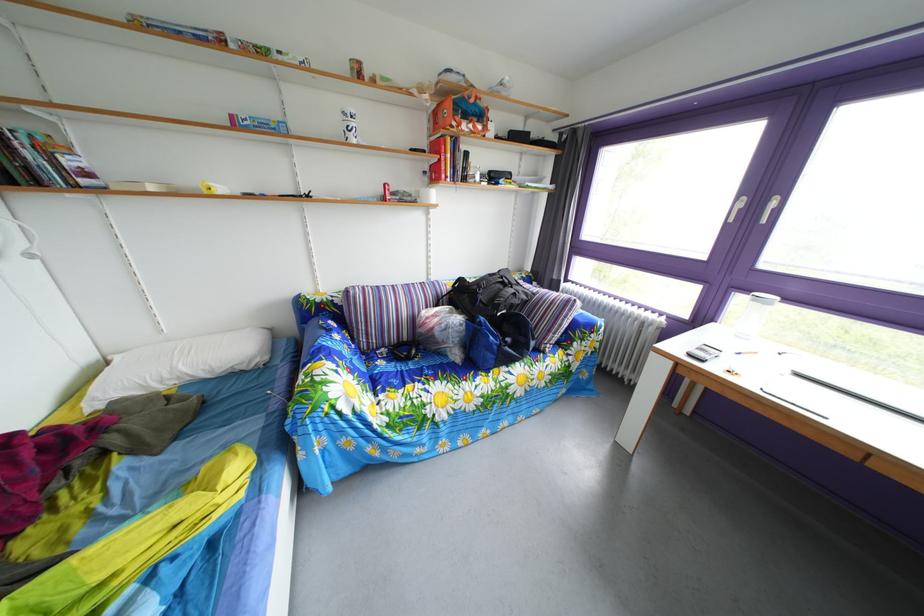
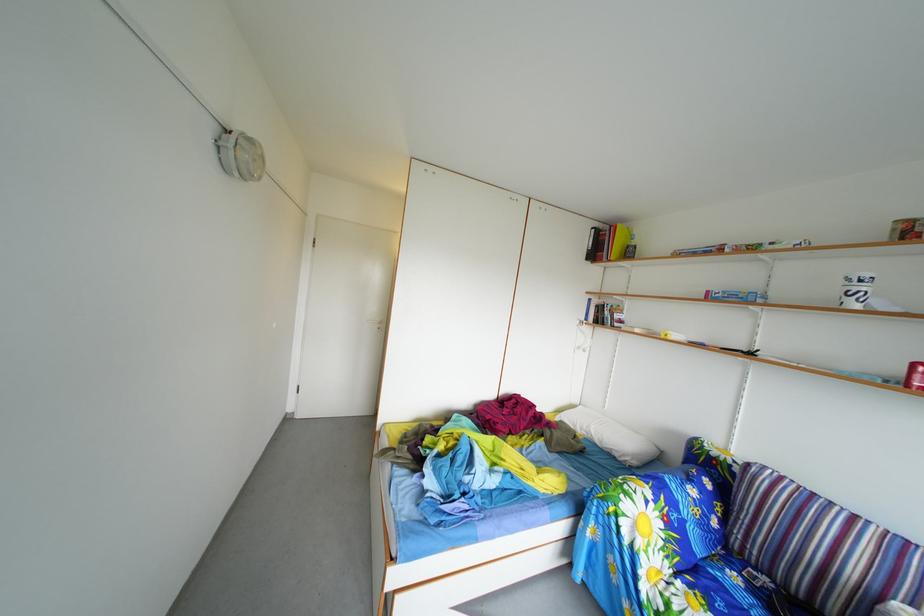
Where in the second image is the point corresponding to point 356,122 from the first image?

(859, 288)